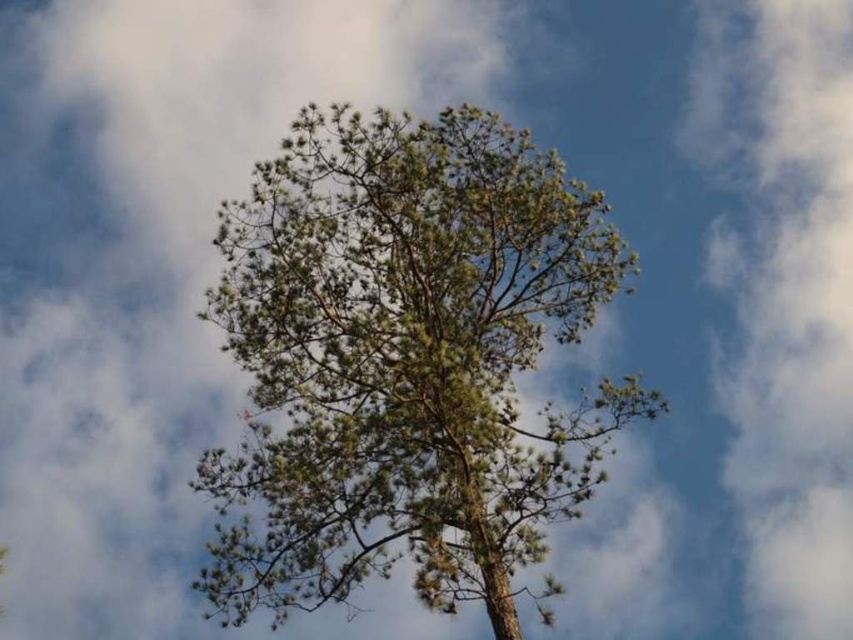
Is green leafy tree at center shorter than white fluffy cloud at upper right?

Yes.

Which is more to the left, green leafy tree at center or white fluffy cloud at upper right?

green leafy tree at center

The height and width of the screenshot is (640, 853). Find the location of `green leafy tree at center`. green leafy tree at center is located at coordinates (405, 362).